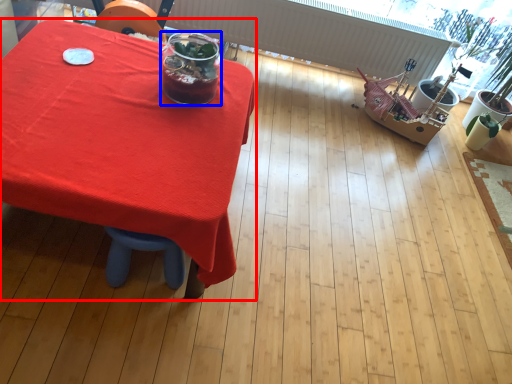
Question: Which of the following is the closest to the observer, table (highlighted by a red box) or drink (highlighted by a blue box)?

Choices:
 (A) table
 (B) drink

Answer: (A)